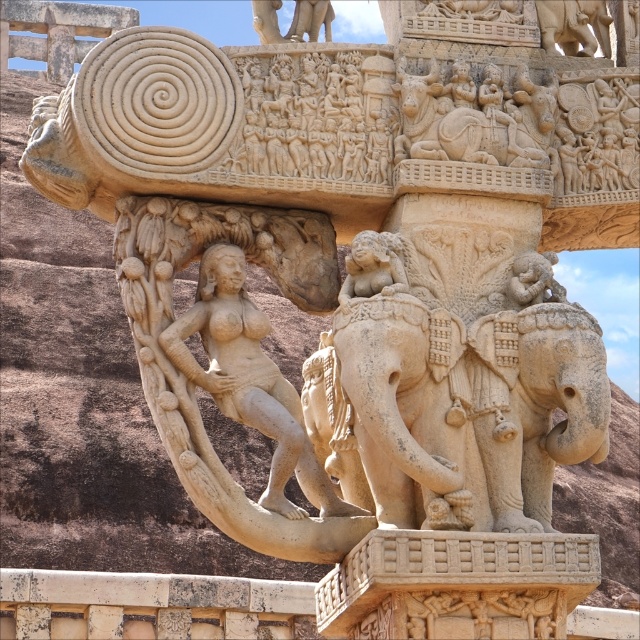
Question: From the image, what is the correct spatial relationship of beige stone elephant at center in relation to carved stone elephant at center?

Choices:
 (A) below
 (B) above

Answer: (A)

Question: Which of the following is the closest to the observer?

Choices:
 (A) (570, 380)
 (B) (317, 477)
 (C) (584, 10)
 (D) (433, 380)

Answer: (A)

Question: Which point is farther to the camera?

Choices:
 (A) beige stone statue at center
 (B) carved stone elephant at center
 (C) beige stone elephant at center

Answer: (A)

Question: Does beige stone elephant at center come in front of beige stone statue at center?

Choices:
 (A) yes
 (B) no

Answer: (A)

Question: Estimate the real-world distances between objects in this image. Which object is farther from the beige stone elephant at center?

Choices:
 (A) carved stone elephant at center
 (B) beige stone elephant at upper center

Answer: (B)

Question: Is beige stone elephant at center smaller than carved stone elephant at center?

Choices:
 (A) yes
 (B) no

Answer: (A)